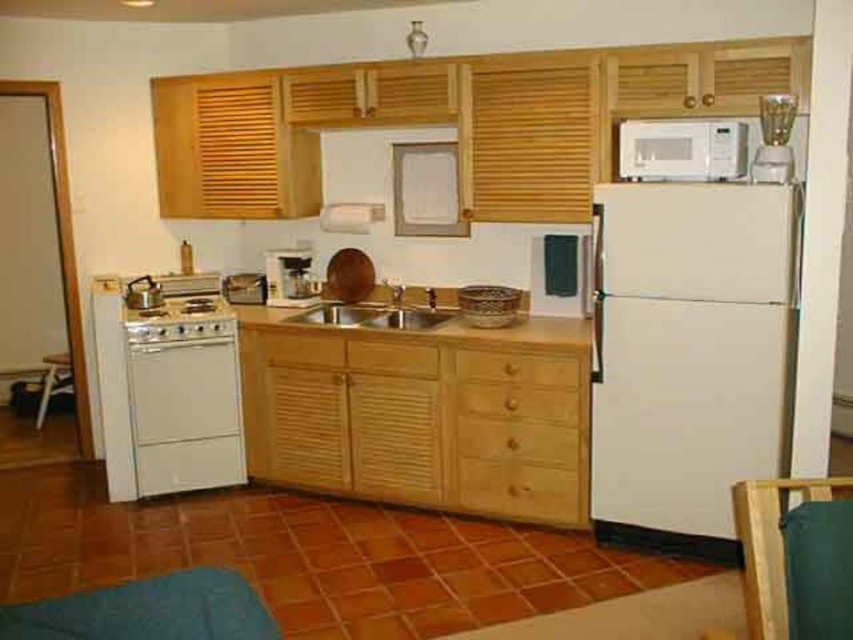
Who is more forward, (x=498, y=358) or (x=238, y=300)?

Point (x=498, y=358) is more forward.

Is wooden drawer at center thinner than brushed metal coffee maker at center?

In fact, wooden drawer at center might be wider than brushed metal coffee maker at center.

Which is behind, point (485, 380) or point (250, 285)?

The point (250, 285) is more distant.

The width and height of the screenshot is (853, 640). What are the coordinates of `wooden drawer at center` in the screenshot? It's located at (517, 368).

Can you confirm if white glossy stove at left is shorter than wooden drawer at center?

Incorrect, white glossy stove at left's height does not fall short of wooden drawer at center's.

Between white glossy stove at left and wooden drawer at center, which one is positioned lower?

wooden drawer at center is below.

Is point (196, 339) in front of point (573, 365)?

No, it is behind (573, 365).

You are a GUI agent. You are given a task and a screenshot of the screen. Output one action in this format:
    pyautogui.click(x=<x>, y=<y>)
    Task: Click on the white glossy stove at left
    
    Given the screenshot: What is the action you would take?
    pyautogui.click(x=180, y=321)

Can you confirm if metallic sink at center is smaller than matte black coffee maker at center?

No.

Who is more distant from viewer, (432, 291) or (276, 260)?

Point (276, 260)

Image resolution: width=853 pixels, height=640 pixels. I want to click on metallic sink at center, so click(383, 308).